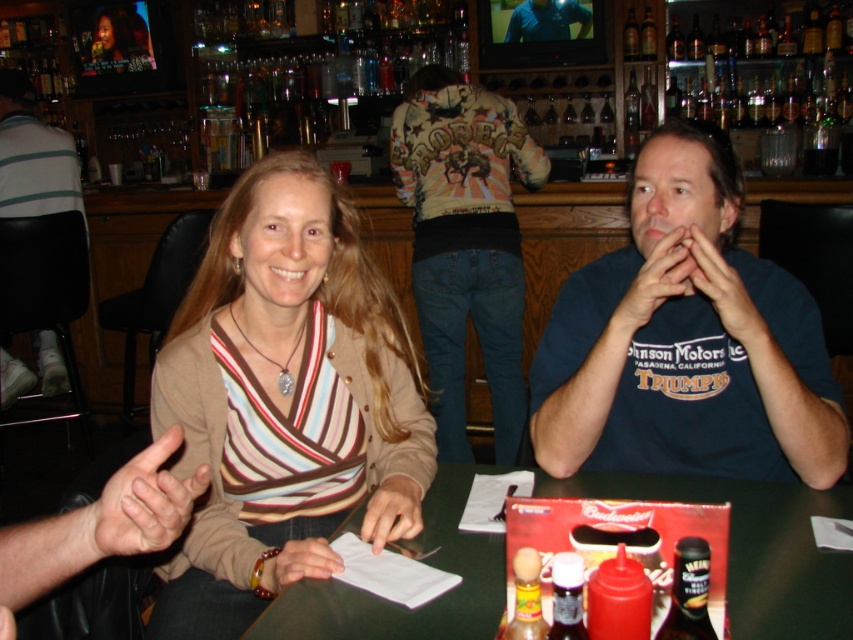
Does smooth skin hand at lower left appear over blue cotton shirt at center?

Incorrect, smooth skin hand at lower left is not positioned above blue cotton shirt at center.

Identify the location of smooth skin hand at lower left. Image resolution: width=853 pixels, height=640 pixels. (144, 500).

Where is `smooth skin hand at lower left`? This screenshot has width=853, height=640. smooth skin hand at lower left is located at coordinates (144, 500).

Which of these two, smooth skin hand at center or smooth leather wallet at lower center, stands taller?

Standing taller between the two is smooth leather wallet at lower center.

Identify the location of smooth skin hand at center. This screenshot has height=640, width=853. (392, 513).

Locate an element on the screen. smooth skin hand at center is located at coordinates (392, 513).

Is point (734, 300) farther from camera compared to point (408, 516)?

Yes, point (734, 300) is farther from viewer.

Based on the photo, who is more distant from viewer, (737, 337) or (415, 509)?

The point (737, 337) is behind.

Is point (724, 328) farther from viewer compared to point (403, 538)?

That is True.

Find the location of a particular element. The width and height of the screenshot is (853, 640). matte blue shirt at right is located at coordinates (724, 292).